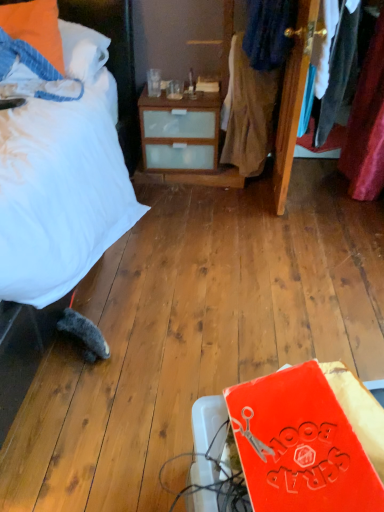
Question: Is orange fabric pillow at upper left to the left or to the right of dark blue fabric at upper right, which ranks as the 1th clothing in bottom-to-top order, in the image?

Choices:
 (A) left
 (B) right

Answer: (A)

Question: Is orange fabric pillow at upper left bigger or smaller than dark blue fabric at upper right, which ranks as the 1th clothing in bottom-to-top order?

Choices:
 (A) small
 (B) big

Answer: (A)

Question: Estimate the real-world distances between objects in this image. Which object is closer to the white soft bed at left?

Choices:
 (A) denim jacket at upper right, acting as the 2th clothing starting from the bottom
 (B) rubberized orange book at lower right
 (C) dark blue fabric at upper right, the second clothing from the top
 (D) orange fabric pillow at upper left

Answer: (D)

Question: Considering the real-world distances, which object is farthest from the dark blue fabric at upper right, which ranks as the 1th clothing in bottom-to-top order?

Choices:
 (A) denim jacket at upper right, acting as the 2th clothing starting from the bottom
 (B) white soft bed at left
 (C) orange fabric pillow at upper left
 (D) rubberized orange book at lower right

Answer: (D)